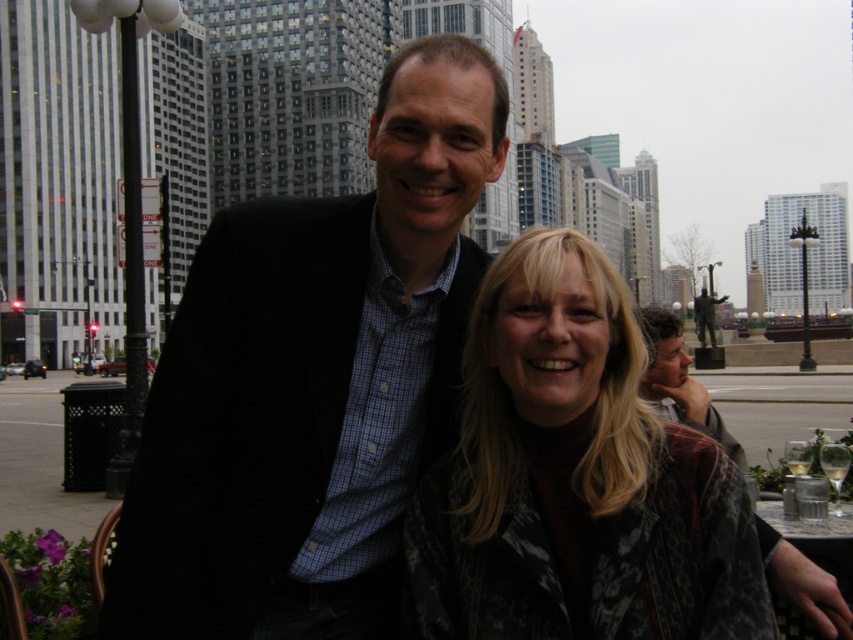
Question: Which object appears farthest from the camera in this image?

Choices:
 (A) patterned fabric jacket at center
 (B) matte black jacket at center

Answer: (B)

Question: In this image, where is patterned fabric jacket at center located relative to matte black jacket at center?

Choices:
 (A) left
 (B) right

Answer: (A)

Question: Which point is closer to the camera taking this photo?

Choices:
 (A) (497, 296)
 (B) (653, 342)

Answer: (A)

Question: Does patterned fabric jacket at center have a larger size compared to matte black jacket at center?

Choices:
 (A) no
 (B) yes

Answer: (A)

Question: Does patterned fabric jacket at center have a lesser width compared to matte black jacket at center?

Choices:
 (A) yes
 (B) no

Answer: (A)